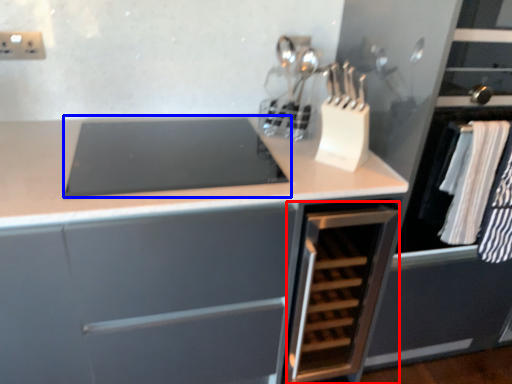
Question: Among these objects, which one is farthest to the camera, cabinetry (highlighted by a red box) or home appliance (highlighted by a blue box)?

Choices:
 (A) cabinetry
 (B) home appliance

Answer: (A)